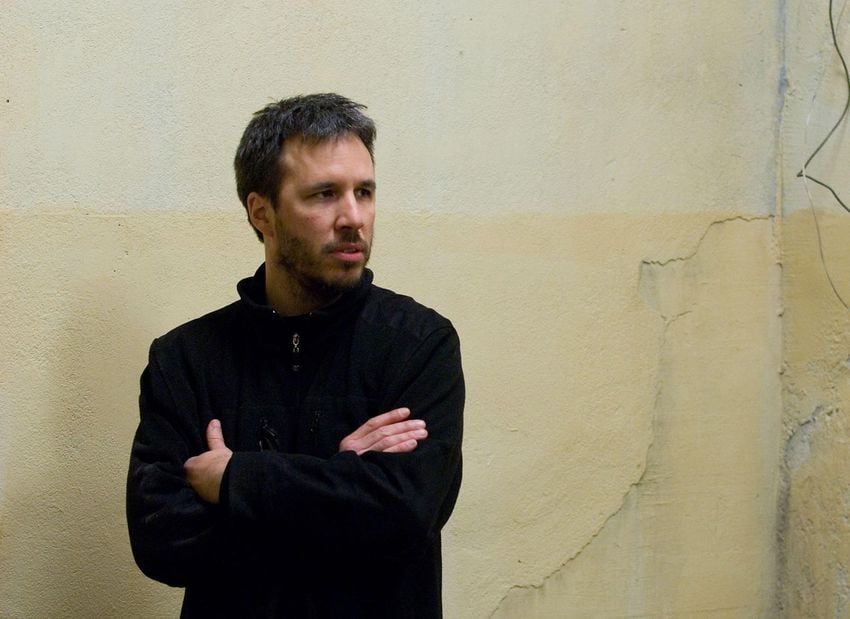
Locate an element on the screen. plaster wall background is located at coordinates (599, 475), (525, 332), (138, 297).